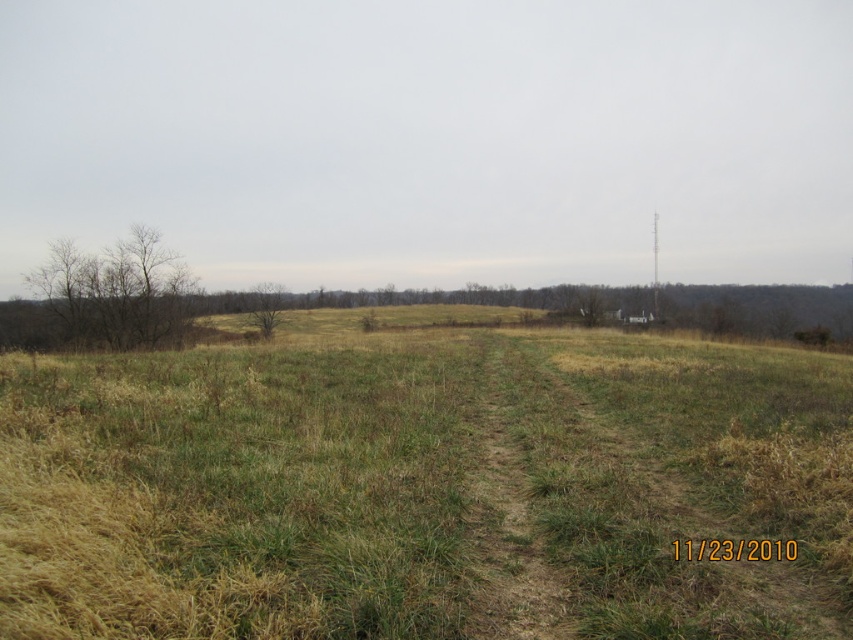
You are standing in the open field and want to walk towards the horizon. Which object, the green grassy field at center or the bare branches at left, will you encounter first as you move forward?

The green grassy field at center will be encountered first because it is located below the bare branches at left, meaning it is closer to the observer in the foreground.

You are standing at the point labeled as point (512, 506) in the image. What is the color of the terrain directly beneath your feet?

The point (512, 506) marks brown dirt trail at center, so the terrain directly beneath your feet is brown.

You are a hiker trying to cross the field. You see the brown dirt trail at center and the brown rough tree at center. Which one is wider?

The brown rough tree at center is wider than the brown dirt trail at center.